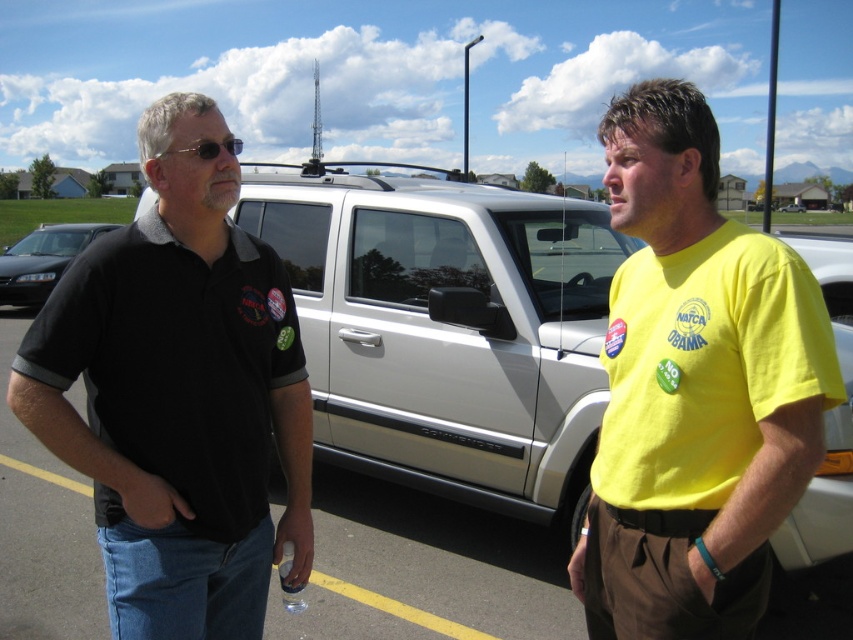
Question: Based on their relative distances, which object is farther from the white matte suv at center?

Choices:
 (A) white matte truck at center
 (B) yellow cotton t-shirt at right

Answer: (A)

Question: Estimate the real-world distances between objects in this image. Which object is farther from the black matte shirt at left?

Choices:
 (A) yellow cotton t-shirt at right
 (B) black glossy sedan at left
 (C) white matte truck at center

Answer: (C)

Question: Is black glossy sedan at left smaller than white matte truck at center?

Choices:
 (A) no
 (B) yes

Answer: (A)

Question: Where is white matte suv at center located in relation to yellow cotton t-shirt at right in the image?

Choices:
 (A) above
 (B) below

Answer: (A)

Question: Which point is farther from the camera taking this photo?

Choices:
 (A) click(x=154, y=115)
 (B) click(x=799, y=209)
 (C) click(x=732, y=440)

Answer: (B)

Question: Can you confirm if yellow cotton t-shirt at right is smaller than white matte truck at center?

Choices:
 (A) no
 (B) yes

Answer: (B)